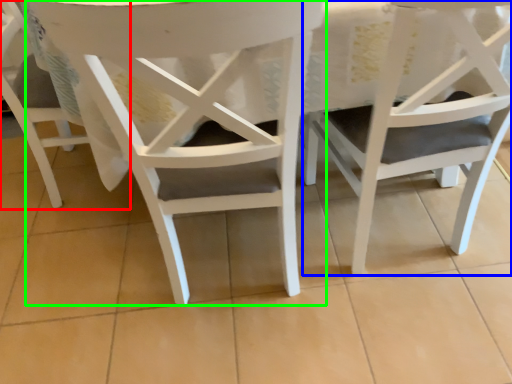
Question: Considering the real-world distances, which object is farthest from chair (highlighted by a red box)? chair (highlighted by a blue box) or chair (highlighted by a green box)?

Choices:
 (A) chair
 (B) chair

Answer: (A)